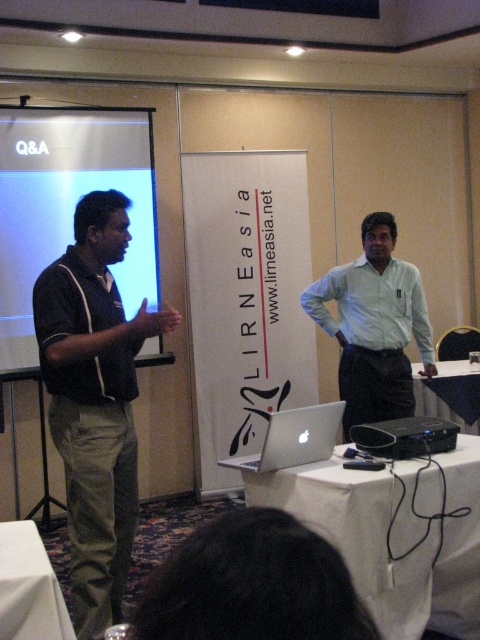
Is silver metallic laptop at center shorter than white fabric table at center?

Correct, silver metallic laptop at center is not as tall as white fabric table at center.

Does silver metallic laptop at center have a smaller size compared to white fabric table at center?

Indeed, silver metallic laptop at center has a smaller size compared to white fabric table at center.

Does point (283, 445) come in front of point (478, 404)?

Yes, point (283, 445) is in front of point (478, 404).

This screenshot has height=640, width=480. Identify the location of silver metallic laptop at center. [x=295, y=438].

Is dark green shirt at left wider than white cloth-covered table at lower center?

Correct, the width of dark green shirt at left exceeds that of white cloth-covered table at lower center.

Which is in front, point (123, 412) or point (6, 605)?

Point (6, 605)

Which is behind, point (109, 611) or point (55, 612)?

The point (109, 611) is behind.

I want to click on dark green shirt at left, so click(x=95, y=401).

From the picture: Can you confirm if light blue shirt at center is positioned above white cloth-covered table at lower center?

Yes, light blue shirt at center is above white cloth-covered table at lower center.

Between light blue shirt at center and white cloth-covered table at lower center, which one appears on the right side from the viewer's perspective?

light blue shirt at center is more to the right.

Is point (324, 282) behind point (60, 614)?

Yes, it is.

Find the location of a particular element. The width and height of the screenshot is (480, 640). light blue shirt at center is located at coordinates (374, 324).